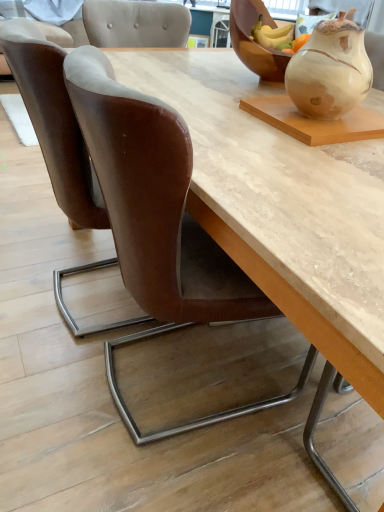
Locate an element on the screen. The width and height of the screenshot is (384, 512). matte ceramic vase at upper right is located at coordinates (330, 70).

Image resolution: width=384 pixels, height=512 pixels. Describe the element at coordinates (251, 40) in the screenshot. I see `wooden bowl at upper right` at that location.

Describe the element at coordinates (158, 223) in the screenshot. This screenshot has width=384, height=512. I see `brown leather chair at left, marked as the first chair in a right-to-left arrangement` at that location.

What are the coordinates of `matte ceramic vase at upper right` in the screenshot? It's located at (330, 70).

Is brown leather chair at lower left, marked as the second chair in a right-to-left arrangement, looking in the opposite direction of matte ceramic vase at upper right?

No.

Consider the image. Is brown leather chair at lower left, marked as the second chair in a right-to-left arrangement, next to matte ceramic vase at upper right?

No, brown leather chair at lower left, marked as the second chair in a right-to-left arrangement, is not touching matte ceramic vase at upper right.

Between point (6, 31) and point (309, 106), which one is positioned in front?

Point (6, 31)

Based on the photo, how much distance is there between wooden bowl at upper right and matte ceramic vase at upper right?

wooden bowl at upper right is 13.12 inches from matte ceramic vase at upper right.

Is wooden bowl at upper right inside the boundaries of matte ceramic vase at upper right, or outside?

wooden bowl at upper right is not enclosed by matte ceramic vase at upper right.

Is wooden bowl at upper right far from matte ceramic vase at upper right?

No, wooden bowl at upper right is in close proximity to matte ceramic vase at upper right.

From a real-world perspective, is wooden bowl at upper right located beneath matte ceramic vase at upper right?

Indeed, from a real-world perspective, wooden bowl at upper right is positioned beneath matte ceramic vase at upper right.

Could you tell me if wooden bowl at upper right is turned towards brown leather chair at left, positioned as the 2th chair in left-to-right order?

No.

From the image's perspective, would you say wooden bowl at upper right is shown under brown leather chair at left, marked as the first chair in a right-to-left arrangement?

Actually, wooden bowl at upper right appears above brown leather chair at left, marked as the first chair in a right-to-left arrangement, in the image.

Based on their positions, is wooden bowl at upper right located to the left or right of brown leather chair at left, positioned as the 2th chair in left-to-right order?

wooden bowl at upper right is positioned on brown leather chair at left, positioned as the 2th chair in left-to-right order,'s right side.

Is wooden bowl at upper right wider than brown leather chair at left, positioned as the 2th chair in left-to-right order?

No.

From a real-world perspective, who is located higher, matte ceramic vase at upper right or brown leather chair at lower left, placed as the 1th chair when sorted from left to right?

In real-world perspective, matte ceramic vase at upper right is above.

Based on the photo, would you say matte ceramic vase at upper right contains brown leather chair at lower left, marked as the second chair in a right-to-left arrangement?

No, brown leather chair at lower left, marked as the second chair in a right-to-left arrangement, is not surrounded by matte ceramic vase at upper right.

Is matte ceramic vase at upper right facing towards brown leather chair at lower left, marked as the second chair in a right-to-left arrangement?

No, matte ceramic vase at upper right is not oriented towards brown leather chair at lower left, marked as the second chair in a right-to-left arrangement.

Consider the image. Considering the relative positions of brown leather chair at left, marked as the first chair in a right-to-left arrangement, and brown leather chair at lower left, marked as the second chair in a right-to-left arrangement, in the image provided, is brown leather chair at left, marked as the first chair in a right-to-left arrangement, to the left or to the right of brown leather chair at lower left, marked as the second chair in a right-to-left arrangement,?

brown leather chair at left, marked as the first chair in a right-to-left arrangement, is to the right of brown leather chair at lower left, marked as the second chair in a right-to-left arrangement.

How different are the orientations of brown leather chair at left, positioned as the 2th chair in left-to-right order, and brown leather chair at lower left, marked as the second chair in a right-to-left arrangement, in degrees?

brown leather chair at left, positioned as the 2th chair in left-to-right order, and brown leather chair at lower left, marked as the second chair in a right-to-left arrangement, are facing 4 degrees away from each other.

Is brown leather chair at left, positioned as the 2th chair in left-to-right order, touching brown leather chair at lower left, marked as the second chair in a right-to-left arrangement?

There is a gap between brown leather chair at left, positioned as the 2th chair in left-to-right order, and brown leather chair at lower left, marked as the second chair in a right-to-left arrangement.

How much distance is there between brown leather chair at left, positioned as the 2th chair in left-to-right order, and brown leather chair at lower left, placed as the 1th chair when sorted from left to right?

11.20 inches.

How different are the orientations of matte ceramic vase at upper right and wooden bowl at upper right in degrees?

matte ceramic vase at upper right and wooden bowl at upper right are facing 0.00198 degrees away from each other.

The height and width of the screenshot is (512, 384). I want to click on bowl below the matte ceramic vase at upper right (from a real-world perspective), so click(x=251, y=40).

Considering the sizes of objects matte ceramic vase at upper right and wooden bowl at upper right in the image provided, who is smaller, matte ceramic vase at upper right or wooden bowl at upper right?

Smaller between the two is matte ceramic vase at upper right.

From the image's perspective, which one is positioned higher, brown leather chair at left, positioned as the 2th chair in left-to-right order, or wooden bowl at upper right?

wooden bowl at upper right, from the image's perspective.

From a real-world perspective, which object stands above the other?

From a 3D spatial view, wooden bowl at upper right is above.

Considering the sizes of objects brown leather chair at left, marked as the first chair in a right-to-left arrangement, and wooden bowl at upper right in the image provided, who is shorter, brown leather chair at left, marked as the first chair in a right-to-left arrangement, or wooden bowl at upper right?

Standing shorter between the two is wooden bowl at upper right.

Is there a large distance between brown leather chair at left, positioned as the 2th chair in left-to-right order, and wooden bowl at upper right?

brown leather chair at left, positioned as the 2th chair in left-to-right order, is actually quite close to wooden bowl at upper right.

The height and width of the screenshot is (512, 384). In order to click on vase in front of the brown leather chair at lower left, placed as the 1th chair when sorted from left to right in this screenshot , I will do `click(330, 70)`.

The height and width of the screenshot is (512, 384). I want to click on bowl on the left of matte ceramic vase at upper right, so click(251, 40).

Estimate the real-world distances between objects in this image. Which object is closer to brown leather chair at left, positioned as the 2th chair in left-to-right order, brown leather chair at lower left, marked as the second chair in a right-to-left arrangement, or matte ceramic vase at upper right?

brown leather chair at lower left, marked as the second chair in a right-to-left arrangement, is positioned closer to the anchor brown leather chair at left, positioned as the 2th chair in left-to-right order.

Estimate the real-world distances between objects in this image. Which object is closer to matte ceramic vase at upper right, brown leather chair at left, marked as the first chair in a right-to-left arrangement, or brown leather chair at lower left, marked as the second chair in a right-to-left arrangement?

Among the two, brown leather chair at left, marked as the first chair in a right-to-left arrangement, is located nearer to matte ceramic vase at upper right.

When comparing their distances from brown leather chair at left, positioned as the 2th chair in left-to-right order, does wooden bowl at upper right or matte ceramic vase at upper right seem closer?

matte ceramic vase at upper right lies closer to brown leather chair at left, positioned as the 2th chair in left-to-right order, than the other object.

Considering their positions, is brown leather chair at left, marked as the first chair in a right-to-left arrangement, positioned closer to brown leather chair at lower left, marked as the second chair in a right-to-left arrangement, than matte ceramic vase at upper right?

brown leather chair at left, marked as the first chair in a right-to-left arrangement, lies closer to brown leather chair at lower left, marked as the second chair in a right-to-left arrangement, than the other object.

Based on their spatial positions, is matte ceramic vase at upper right or brown leather chair at left, positioned as the 2th chair in left-to-right order, further from brown leather chair at lower left, marked as the second chair in a right-to-left arrangement?

matte ceramic vase at upper right.

Looking at the image, which one is located closer to wooden bowl at upper right, brown leather chair at left, marked as the first chair in a right-to-left arrangement, or matte ceramic vase at upper right?

matte ceramic vase at upper right is positioned closer to the anchor wooden bowl at upper right.

Estimate the real-world distances between objects in this image. Which object is further from wooden bowl at upper right, brown leather chair at lower left, placed as the 1th chair when sorted from left to right, or matte ceramic vase at upper right?

brown leather chair at lower left, placed as the 1th chair when sorted from left to right, is positioned further to the anchor wooden bowl at upper right.

Estimate the real-world distances between objects in this image. Which object is closer to brown leather chair at left, positioned as the 2th chair in left-to-right order, matte ceramic vase at upper right or brown leather chair at lower left, marked as the second chair in a right-to-left arrangement?

Answer: The object closer to brown leather chair at left, positioned as the 2th chair in left-to-right order, is brown leather chair at lower left, marked as the second chair in a right-to-left arrangement.

Locate an element on the screen. The height and width of the screenshot is (512, 384). bowl between brown leather chair at lower left, placed as the 1th chair when sorted from left to right, and matte ceramic vase at upper right from left to right is located at coordinates (251, 40).

I want to click on vase between wooden bowl at upper right and brown leather chair at left, positioned as the 2th chair in left-to-right order, in the vertical direction, so click(x=330, y=70).

In order to click on chair located between brown leather chair at lower left, marked as the second chair in a right-to-left arrangement, and matte ceramic vase at upper right in the left-right direction in this screenshot , I will do `click(158, 223)`.

Locate an element on the screen. chair that lies between wooden bowl at upper right and brown leather chair at left, positioned as the 2th chair in left-to-right order, from top to bottom is located at coordinates (53, 121).